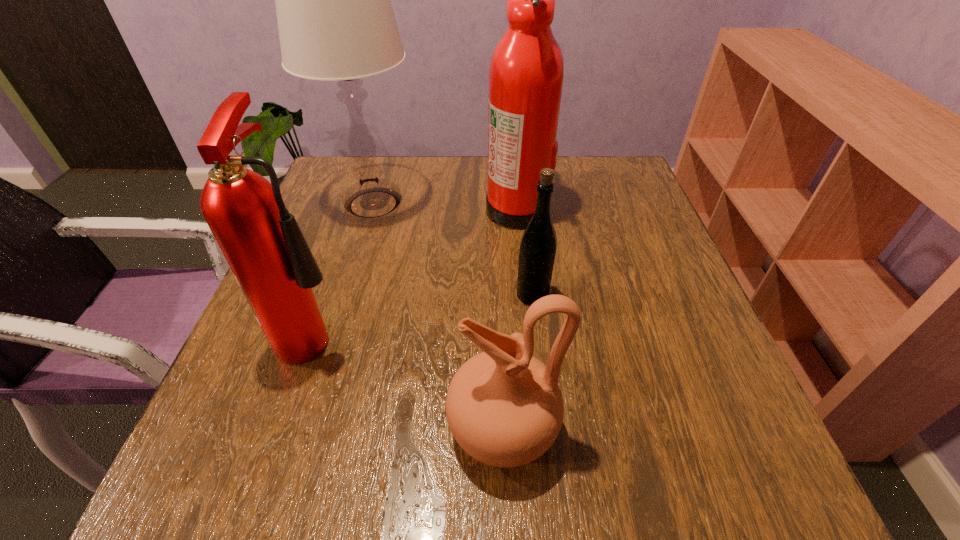
At what (x,y) coordinates should I click in order to perform the action: click on the farther fire extinguisher. Please return your answer as a coordinate pair (x, y). Looking at the image, I should click on (526, 72).

This screenshot has height=540, width=960. What are the coordinates of `the right fire extinguisher` in the screenshot? It's located at (526, 72).

I want to click on table lamp, so [335, 19].

Find the location of a particular element. This screenshot has width=960, height=540. the shorter fire extinguisher is located at coordinates (261, 241).

You are a GUI agent. You are given a task and a screenshot of the screen. Output one action in this format:
    pyautogui.click(x=<x>, y=<y>)
    Task: Click on the left fire extinguisher
    This screenshot has height=540, width=960.
    Given the screenshot: What is the action you would take?
    pyautogui.click(x=261, y=241)

You are a GUI agent. You are given a task and a screenshot of the screen. Output one action in this format:
    pyautogui.click(x=<x>, y=<y>)
    Task: Click on the beer bottle
    
    Given the screenshot: What is the action you would take?
    pyautogui.click(x=538, y=246)

Identify the location of pottery. (504, 407).

Find the location of `free space located on the label side of the farther fire extinguisher`. free space located on the label side of the farther fire extinguisher is located at coordinates pyautogui.click(x=382, y=208).

In order to click on free space located 0.080m on the label side of the farther fire extinguisher in this screenshot , I will do `click(452, 208)`.

Where is `free space located 0.310m on the label side of the farther fire extinguisher`? The image size is (960, 540). free space located 0.310m on the label side of the farther fire extinguisher is located at coordinates (357, 208).